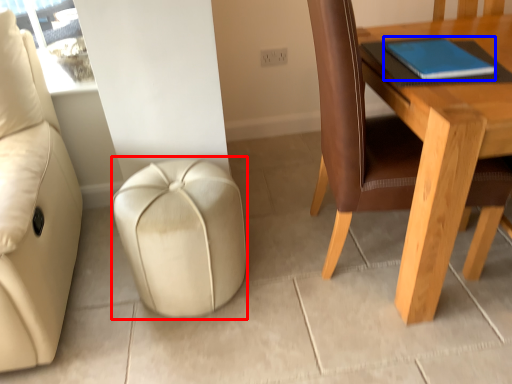
Question: Which of the following is the closest to the observer, stool (highlighted by a red box) or notebook (highlighted by a blue box)?

Choices:
 (A) stool
 (B) notebook

Answer: (B)